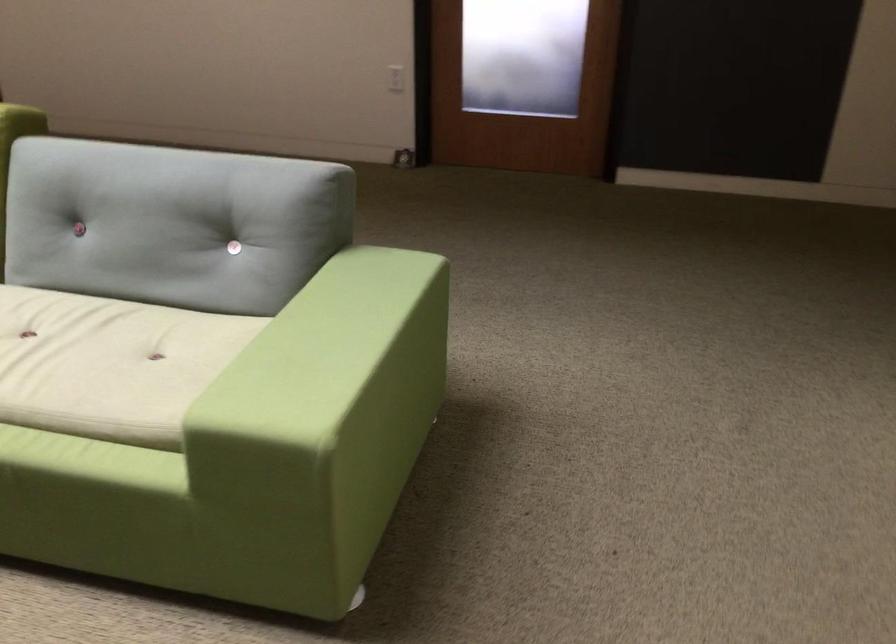
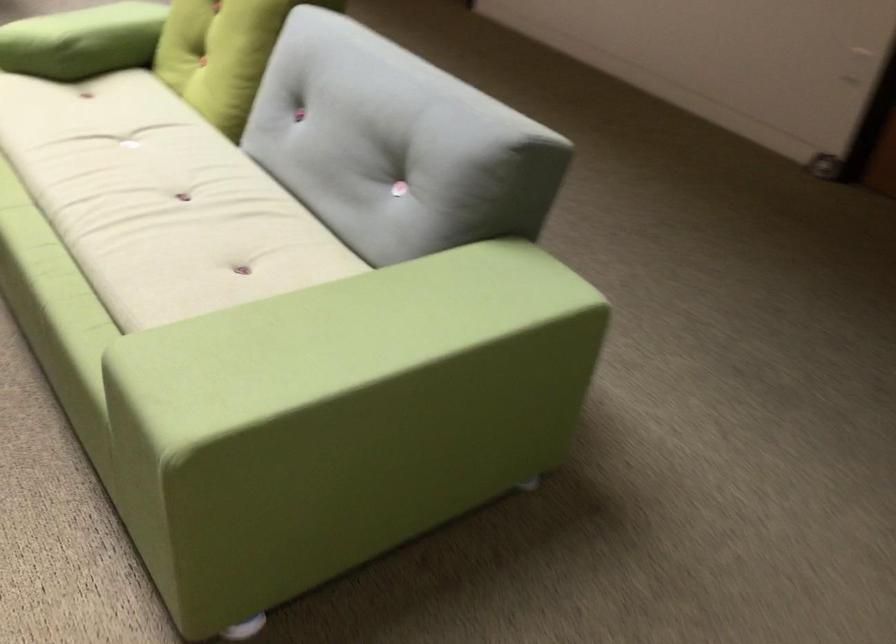
Question: Based on the continuous images, in which direction is the camera rotating? Reply with the corresponding letter.

Choices:
 (A) Left
 (B) Right
 (C) Up
 (D) Down

Answer: (A)